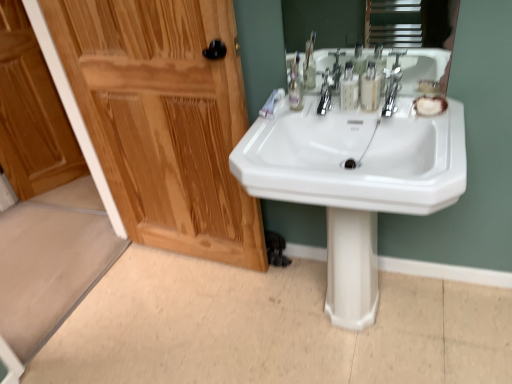
The image size is (512, 384). What do you see at coordinates (164, 119) in the screenshot?
I see `shiny wood door at left` at bounding box center [164, 119].

Locate an element on the screen. translucent plastic mouthwash at center, arranged as the first mouthwash when viewed from the right is located at coordinates (370, 88).

What are the coordinates of `translucent plastic mouthwash at upper center, the 2th mouthwash viewed from the right` in the screenshot? It's located at (349, 88).

Where is `white matte soap at right`? This screenshot has width=512, height=384. white matte soap at right is located at coordinates (430, 105).

This screenshot has height=384, width=512. In order to click on wooden cabinet at left in this screenshot , I will do `click(32, 113)`.

You are a GUI agent. You are given a task and a screenshot of the screen. Output one action in this format:
    pyautogui.click(x=<x>, y=<y>)
    Task: Click on the white matte toothpaste at upper right
    This screenshot has width=512, height=384.
    Given the screenshot: What is the action you would take?
    pyautogui.click(x=271, y=103)

Is translucent plastic mouthwash at upper center, which is counted as the 1th mouthwash, starting from the left, far from white glossy pedestal at center?

They are positioned close to each other.

Can you confirm if translucent plastic mouthwash at upper center, the 2th mouthwash viewed from the right, is taller than white glossy pedestal at center?

In fact, translucent plastic mouthwash at upper center, the 2th mouthwash viewed from the right, may be shorter than white glossy pedestal at center.

Can you confirm if translucent plastic mouthwash at upper center, the 2th mouthwash viewed from the right, is positioned to the left of white glossy pedestal at center?

Yes, translucent plastic mouthwash at upper center, the 2th mouthwash viewed from the right, is to the left of white glossy pedestal at center.

From the picture: Is chrome metallic faucet at upper center facing away from white glossy pedestal at center?

chrome metallic faucet at upper center does not have its back to white glossy pedestal at center.

From the image's perspective, is chrome metallic faucet at upper center located beneath white glossy pedestal at center?

No.

Which is more to the left, chrome metallic faucet at upper center or white glossy pedestal at center?

white glossy pedestal at center.

Based on the photo, is white glossy pedestal at center inside chrome metallic faucet at upper center?

No, white glossy pedestal at center is not surrounded by chrome metallic faucet at upper center.

Considering the sizes of objects shiny wood door at left and white matte toothpaste at upper right in the image provided, who is thinner, shiny wood door at left or white matte toothpaste at upper right?

shiny wood door at left is thinner.

Considering the relative positions of shiny wood door at left and white matte toothpaste at upper right in the image provided, is shiny wood door at left in front of white matte toothpaste at upper right?

Yes, it is.

Looking at the image, does shiny wood door at left seem bigger or smaller compared to white matte toothpaste at upper right?

Clearly, shiny wood door at left is larger in size than white matte toothpaste at upper right.

Locate an element on the screen. toothpaste to the right of shiny wood door at left is located at coordinates (271, 103).

Is white glossy pedestal at center looking in the opposite direction of white matte soap at right?

No, white glossy pedestal at center's orientation is not away from white matte soap at right.

Identify the location of soap that is above the white glossy pedestal at center (from the image's perspective). (430, 105).

From the picture: Does white glossy pedestal at center have a greater height compared to white matte soap at right?

Correct, white glossy pedestal at center is much taller as white matte soap at right.

Based on the photo, from the image's perspective, is white glossy pedestal at center below white matte soap at right?

Correct, white glossy pedestal at center appears lower than white matte soap at right in the image.

Is white glossy sink at center wider or thinner than white glossy pedestal at center?

white glossy sink at center is wider than white glossy pedestal at center.

Between white glossy sink at center and white glossy pedestal at center, which one has less height?

Standing shorter between the two is white glossy sink at center.

The height and width of the screenshot is (384, 512). I want to click on tap to the right of white glossy sink at center, so click(x=391, y=90).

Between white glossy sink at center and chrome metallic faucet at upper center, which one has smaller size?

chrome metallic faucet at upper center.

From a real-world perspective, is white glossy sink at center on chrome metallic faucet at upper center?

No, from a real-world perspective, white glossy sink at center is not on top of chrome metallic faucet at upper center.

How different are the orientations of white glossy sink at center and chrome metallic faucet at upper center in degrees?

The facing directions of white glossy sink at center and chrome metallic faucet at upper center are 2.54 degrees apart.

From the image's perspective, between white matte toothpaste at upper right and white glossy sink at center, who is located below?

white glossy sink at center is shown below in the image.

Can you tell me how much white matte toothpaste at upper right and white glossy sink at center differ in facing direction?

The angular difference between white matte toothpaste at upper right and white glossy sink at center is 0.109 degrees.

The image size is (512, 384). Identify the location of sink located on the right of white matte toothpaste at upper right. (355, 158).

Which mouthwash is the 2nd one when counting from the left side of the white glossy pedestal at center? Please provide its 2D coordinates.

[(349, 88)]

The height and width of the screenshot is (384, 512). What are the coordinates of `pillar lying behind the chrome metallic faucet at upper center` in the screenshot? It's located at (351, 268).

Estimate the real-world distances between objects in this image. Which object is closer to white glossy sink at center, white matte soap at right or white matte toothpaste at upper right?

Based on the image, white matte soap at right appears to be nearer to white glossy sink at center.

Considering their positions, is white matte toothpaste at upper right positioned further to white glossy sink at center than white matte soap at right?

The object further to white glossy sink at center is white matte toothpaste at upper right.

Estimate the real-world distances between objects in this image. Which object is closer to shiny wood door at left, translucent plastic mouthwash at upper center, the 2th mouthwash viewed from the right, or white matte toothpaste at upper right?

Based on the image, white matte toothpaste at upper right appears to be nearer to shiny wood door at left.

When comparing their distances from translucent plastic mouthwash at center, which is the second mouthwash from left to right, does chrome metallic faucet at upper center or shiny wood door at left seem closer?

Based on the image, chrome metallic faucet at upper center appears to be nearer to translucent plastic mouthwash at center, which is the second mouthwash from left to right.

When comparing their distances from white matte toothpaste at upper right, does translucent plastic mouthwash at upper center, which is counted as the 1th mouthwash, starting from the left, or wooden cabinet at left seem further?

Among the two, wooden cabinet at left is located further to white matte toothpaste at upper right.

Which object lies further to the anchor point translucent plastic mouthwash at center, which is the second mouthwash from left to right, translucent plastic mouthwash at upper center, which is counted as the 1th mouthwash, starting from the left, or white glossy sink at center?

white glossy sink at center.

When comparing their distances from white glossy sink at center, does shiny wood door at left or translucent plastic mouthwash at upper center, which is counted as the 1th mouthwash, starting from the left, seem closer?

translucent plastic mouthwash at upper center, which is counted as the 1th mouthwash, starting from the left.

From the image, which object appears to be farther from translucent plastic mouthwash at center, which is the second mouthwash from left to right, shiny wood door at left or white matte toothpaste at upper right?

shiny wood door at left is positioned further to the anchor translucent plastic mouthwash at center, which is the second mouthwash from left to right.

You are a GUI agent. You are given a task and a screenshot of the screen. Output one action in this format:
    pyautogui.click(x=<x>, y=<y>)
    Task: Click on the tap situated between wooden cabinet at left and white matte soap at right from left to right
    The image size is (512, 384).
    Given the screenshot: What is the action you would take?
    pyautogui.click(x=391, y=90)

Locate an element on the screen. toothpaste between translucent plastic mouthwash at upper center, the 2th mouthwash viewed from the right, and white glossy pedestal at center, in the vertical direction is located at coordinates (271, 103).

At what (x,y) coordinates should I click in order to perform the action: click on toothpaste situated between wooden cabinet at left and white glossy sink at center from left to right. Please return your answer as a coordinate pair (x, y). The width and height of the screenshot is (512, 384). Looking at the image, I should click on (271, 103).

I want to click on toothpaste between translucent plastic mouthwash at center, which is the second mouthwash from left to right, and white glossy pedestal at center, in the vertical direction, so click(x=271, y=103).